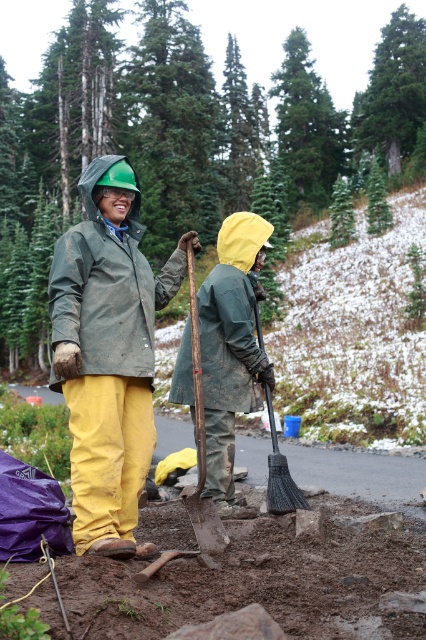
You are a photographer standing at the camera position. You want to take a photo of both the point at coordinates (x=215, y=468) and the point at (x=273, y=426). Which point will appear closer to the front of the photo?

Point at coordinates (x=215, y=468) will appear closer to the front of the photo because it is further to the camera than point at coordinates (x=273, y=426).